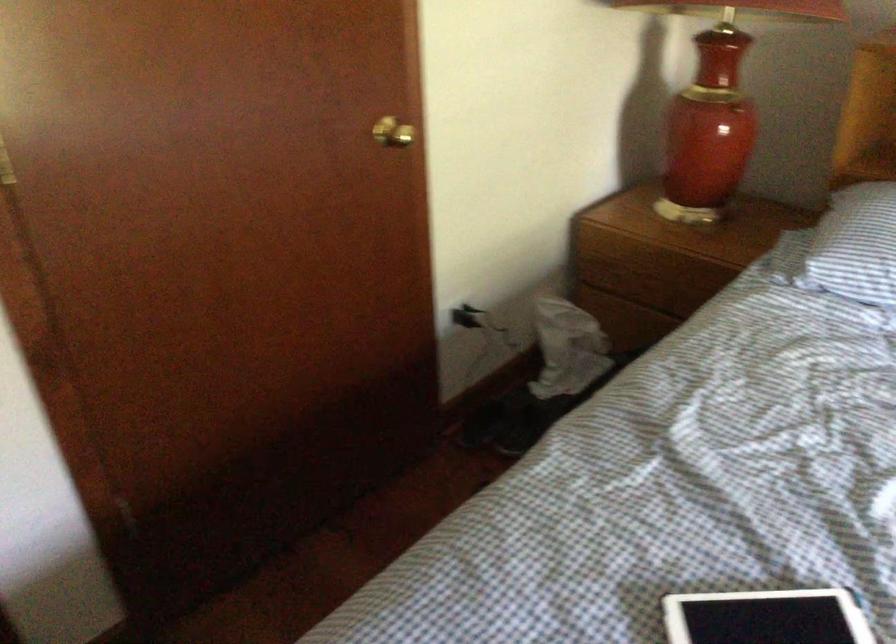
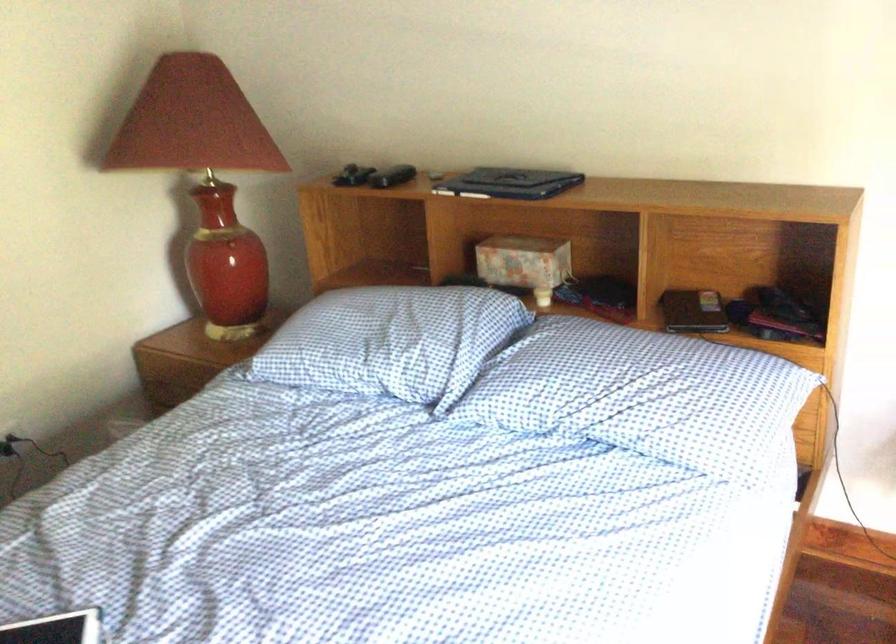
Find the pixel in the second image that matches point (739, 127) in the first image.

(229, 249)